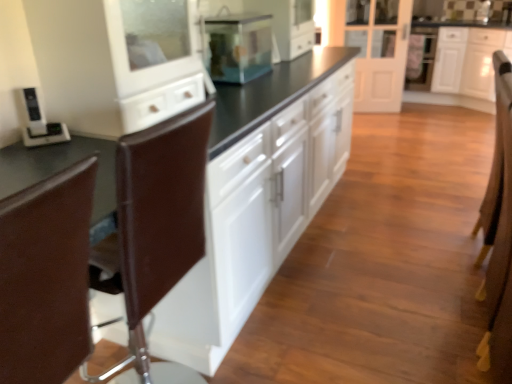
Question: From a real-world perspective, is white glossy cabinets at center, which appears as the 1th cabinetry when viewed from the left, physically below white glossy cabinet at upper right, which ranks as the 2th cabinetry in front-to-back order?

Choices:
 (A) no
 (B) yes

Answer: (A)

Question: Considering the relative sizes of white glossy cabinets at center, the 2th cabinetry from the back, and white glossy cabinet at upper right, arranged as the 2th cabinetry when viewed from the left, in the image provided, is white glossy cabinets at center, the 2th cabinetry from the back, taller than white glossy cabinet at upper right, arranged as the 2th cabinetry when viewed from the left,?

Choices:
 (A) yes
 (B) no

Answer: (A)

Question: From a real-world perspective, is white glossy cabinets at center, which appears as the 1th cabinetry when viewed from the left, positioned over white glossy cabinet at upper right, placed as the 1th cabinetry when sorted from right to left, based on gravity?

Choices:
 (A) no
 (B) yes

Answer: (B)

Question: Is white glossy cabinets at center, the 2th cabinetry in the right-to-left sequence, facing away from white glossy cabinet at upper right, which is the first cabinetry in back-to-front order?

Choices:
 (A) no
 (B) yes

Answer: (A)

Question: Is white glossy cabinets at center, the first cabinetry viewed from the front, bigger than white glossy cabinet at upper right, which ranks as the 2th cabinetry in front-to-back order?

Choices:
 (A) no
 (B) yes

Answer: (B)

Question: Is white glossy cabinet at upper right, which ranks as the 2th cabinetry in front-to-back order, in front of or behind black plastic phone at left in the image?

Choices:
 (A) behind
 (B) front

Answer: (A)

Question: Does point (462, 49) appear closer or farther from the camera than point (38, 140)?

Choices:
 (A) farther
 (B) closer

Answer: (A)

Question: In the image, is white glossy cabinet at upper right, which is the first cabinetry in back-to-front order, on the left side or the right side of black plastic phone at left?

Choices:
 (A) right
 (B) left

Answer: (A)

Question: Is white glossy cabinet at upper right, which ranks as the 2th cabinetry in front-to-back order, situated inside black plastic phone at left or outside?

Choices:
 (A) outside
 (B) inside

Answer: (A)

Question: Is white glossy cabinet at upper right, placed as the 1th cabinetry when sorted from right to left, taller or shorter than transparent glass fish tank at center?

Choices:
 (A) short
 (B) tall

Answer: (B)

Question: From a real-world perspective, relative to transparent glass fish tank at center, is white glossy cabinet at upper right, placed as the 1th cabinetry when sorted from right to left, vertically above or below?

Choices:
 (A) above
 (B) below

Answer: (B)

Question: In terms of width, does white glossy cabinet at upper right, which ranks as the 2th cabinetry in front-to-back order, look wider or thinner when compared to transparent glass fish tank at center?

Choices:
 (A) wide
 (B) thin

Answer: (A)

Question: Based on their positions, is white glossy cabinet at upper right, placed as the 1th cabinetry when sorted from right to left, located to the left or right of transparent glass fish tank at center?

Choices:
 (A) right
 (B) left

Answer: (A)

Question: Visually, is brown leather armchair at right positioned to the left or to the right of white glossy cabinet at upper right, arranged as the 2th cabinetry when viewed from the left?

Choices:
 (A) left
 (B) right

Answer: (A)

Question: Relative to white glossy cabinet at upper right, placed as the 1th cabinetry when sorted from right to left, is brown leather armchair at right in front or behind?

Choices:
 (A) behind
 (B) front

Answer: (B)